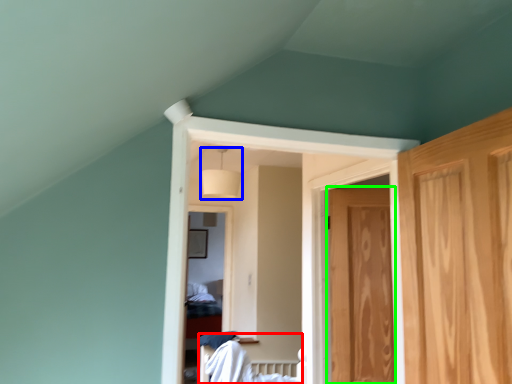
Question: Based on their relative distances, which object is farther from bed (highlighted by a red box)? Choose from lamp (highlighted by a blue box) and door (highlighted by a green box).

Choices:
 (A) lamp
 (B) door

Answer: (A)